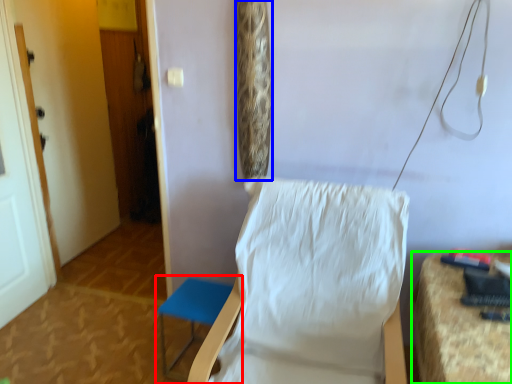
Question: Which is farther away from furniture (highlighted by a red box)? curtain (highlighted by a blue box) or furniture (highlighted by a green box)?

Choices:
 (A) curtain
 (B) furniture

Answer: (B)